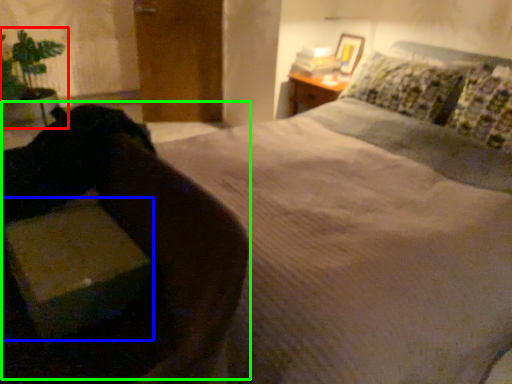
Question: Based on their relative distances, which object is nearer to houseplant (highlighted by a red box)? Choose from cardboard box (highlighted by a blue box) and swivel chair (highlighted by a green box).

Choices:
 (A) cardboard box
 (B) swivel chair

Answer: (B)